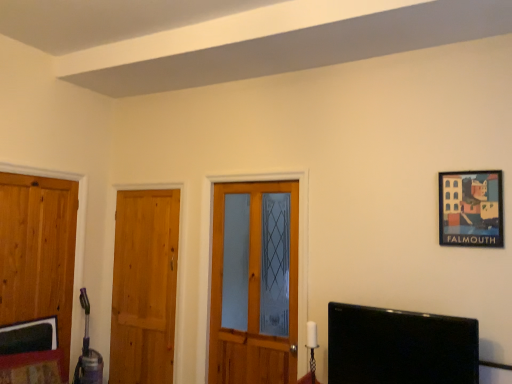
What do you see at coordinates (38, 252) in the screenshot?
I see `wooden door at left, the third door positioned from the right` at bounding box center [38, 252].

Describe the element at coordinates (471, 208) in the screenshot. The width and height of the screenshot is (512, 384). I see `wooden framed picture at upper right` at that location.

What are the coordinates of `wooden door at left, which is the 2th door from right to left` in the screenshot? It's located at (144, 286).

Can wooden door at left, the first door from the left, be found inside black glossy tv at lower right?

No.

From the image's perspective, is black glossy tv at lower right under wooden door at left, the first door from the left?

Yes, from the image's perspective, black glossy tv at lower right is beneath wooden door at left, the first door from the left.

Which is in front, point (389, 346) or point (66, 190)?

The point (389, 346) is more forward.

From a real-world perspective, which object rests below the other?

black glossy tv at lower right, from a real-world perspective.

Considering the sizes of wooden door at left, the third door positioned from the right, and wooden door at center, the 1th door viewed from the right, in the image, is wooden door at left, the third door positioned from the right, taller or shorter than wooden door at center, the 1th door viewed from the right,?

wooden door at left, the third door positioned from the right, is taller than wooden door at center, the 1th door viewed from the right.

Which is in front, wooden door at left, the third door positioned from the right, or wooden door at center, the third door when ordered from left to right?

wooden door at left, the third door positioned from the right, is in front.

From the image's perspective, would you say wooden door at left, the third door positioned from the right, is shown under wooden door at center, the third door when ordered from left to right?

No.

Which object is thinner, wooden door at left, the first door from the left, or wooden door at center, the 1th door viewed from the right?

wooden door at left, the first door from the left, is thinner.

Is black glossy tv at lower right not close to wooden framed picture at upper right?

black glossy tv at lower right is near wooden framed picture at upper right, not far away.

In terms of size, does black glossy tv at lower right appear bigger or smaller than wooden framed picture at upper right?

In the image, black glossy tv at lower right appears to be larger than wooden framed picture at upper right.

Between black glossy tv at lower right and wooden framed picture at upper right, which one appears on the left side from the viewer's perspective?

From the viewer's perspective, black glossy tv at lower right appears more on the left side.

Consider the image. From a real-world perspective, which is physically below, black glossy tv at lower right or wooden framed picture at upper right?

→ From a 3D spatial view, black glossy tv at lower right is below.

Does wooden door at left, the first door from the left, touch black glossy tv at lower right?

No, wooden door at left, the first door from the left, is not with black glossy tv at lower right.

Which of these two, wooden door at left, the third door positioned from the right, or black glossy tv at lower right, stands taller?

wooden door at left, the third door positioned from the right.

Is black glossy tv at lower right surrounded by wooden door at left, the first door from the left?

No, wooden door at left, the first door from the left, does not contain black glossy tv at lower right.

Is wooden framed picture at upper right thinner than wooden door at left, which ranks as the 2th door in left-to-right order?

Yes.

From a real-world perspective, is wooden framed picture at upper right physically located above or below wooden door at left, which ranks as the 2th door in left-to-right order?

wooden framed picture at upper right is situated higher than wooden door at left, which ranks as the 2th door in left-to-right order, in the real world.

Does wooden framed picture at upper right have a larger size compared to wooden door at left, which ranks as the 2th door in left-to-right order?

No.

Which door is the 3rd one when counting from the back of the wooden framed picture at upper right? Please provide its 2D coordinates.

[(144, 286)]

Does wooden door at center, the third door when ordered from left to right, come in front of wooden door at left, which is the 2th door from right to left?

Yes, wooden door at center, the third door when ordered from left to right, is in front of wooden door at left, which is the 2th door from right to left.

Find the location of a particular element. Image resolution: width=512 pixels, height=384 pixels. the 1st door to the left when counting from the wooden door at center, the 1th door viewed from the right is located at coordinates (144, 286).

Does wooden door at center, the 1th door viewed from the right, turn towards wooden door at left, which ranks as the 2th door in left-to-right order?

No, wooden door at center, the 1th door viewed from the right, is not aimed at wooden door at left, which ranks as the 2th door in left-to-right order.

Choose the correct answer: Is wooden door at center, the third door when ordered from left to right, inside wooden door at left, which is the 2th door from right to left, or outside it?

wooden door at center, the third door when ordered from left to right, is not enclosed by wooden door at left, which is the 2th door from right to left.

Based on the photo, how many degrees apart are the facing directions of wooden door at center, the third door when ordered from left to right, and wooden framed picture at upper right?

0.271 degrees separate the facing orientations of wooden door at center, the third door when ordered from left to right, and wooden framed picture at upper right.

Can you confirm if wooden door at center, the 1th door viewed from the right, is thinner than wooden framed picture at upper right?

In fact, wooden door at center, the 1th door viewed from the right, might be wider than wooden framed picture at upper right.

From the image's perspective, would you say wooden door at center, the third door when ordered from left to right, is shown under wooden framed picture at upper right?

Yes, from the image's perspective, wooden door at center, the third door when ordered from left to right, is below wooden framed picture at upper right.

Identify the location of the 1st door behind the black glossy tv at lower right. The height and width of the screenshot is (384, 512). (38, 252).

This screenshot has height=384, width=512. What are the coordinates of `door above the wooden door at left, the third door positioned from the right (from a real-world perspective)` in the screenshot? It's located at coord(214,257).

Estimate the real-world distances between objects in this image. Which object is closer to wooden door at left, the third door positioned from the right, wooden door at left, which ranks as the 2th door in left-to-right order, or wooden framed picture at upper right?

Based on the image, wooden door at left, which ranks as the 2th door in left-to-right order, appears to be nearer to wooden door at left, the third door positioned from the right.

Which object lies further to the anchor point wooden door at left, which ranks as the 2th door in left-to-right order, wooden door at center, the third door when ordered from left to right, or black glossy tv at lower right?

black glossy tv at lower right.

Which object lies further to the anchor point wooden door at left, which is the 2th door from right to left, black glossy tv at lower right or wooden door at left, the first door from the left?

Among the two, black glossy tv at lower right is located further to wooden door at left, which is the 2th door from right to left.

From the image, which object appears to be farther from wooden door at center, the 1th door viewed from the right, wooden door at left, which is the 2th door from right to left, or wooden framed picture at upper right?

wooden framed picture at upper right is positioned further to the anchor wooden door at center, the 1th door viewed from the right.

When comparing their distances from wooden door at left, the third door positioned from the right, does wooden framed picture at upper right or wooden door at left, which is the 2th door from right to left, seem closer?

Among the two, wooden door at left, which is the 2th door from right to left, is located nearer to wooden door at left, the third door positioned from the right.

From the image, which object appears to be farther from wooden door at left, the first door from the left, wooden door at left, which is the 2th door from right to left, or black glossy tv at lower right?

black glossy tv at lower right.

From the image, which object appears to be nearer to wooden framed picture at upper right, wooden door at left, the first door from the left, or black glossy tv at lower right?

Among the two, black glossy tv at lower right is located nearer to wooden framed picture at upper right.

When comparing their distances from wooden framed picture at upper right, does wooden door at center, the 1th door viewed from the right, or black glossy tv at lower right seem further?

The object further to wooden framed picture at upper right is wooden door at center, the 1th door viewed from the right.

You are a GUI agent. You are given a task and a screenshot of the screen. Output one action in this format:
    pyautogui.click(x=<x>, y=<y>)
    Task: Click on the door between wooden door at left, the first door from the left, and wooden door at center, the third door when ordered from left to right, from left to right
    The width and height of the screenshot is (512, 384).
    Given the screenshot: What is the action you would take?
    pyautogui.click(x=144, y=286)

Locate an element on the screen. The width and height of the screenshot is (512, 384). television located between wooden door at left, the first door from the left, and wooden framed picture at upper right in the left-right direction is located at coordinates (400, 347).

Find the location of `television located between wooden door at center, the third door when ordered from left to right, and wooden framed picture at upper right in the left-right direction`. television located between wooden door at center, the third door when ordered from left to right, and wooden framed picture at upper right in the left-right direction is located at coordinates (400, 347).

Identify the location of door between wooden door at left, which is the 2th door from right to left, and black glossy tv at lower right, in the horizontal direction. (214, 257).